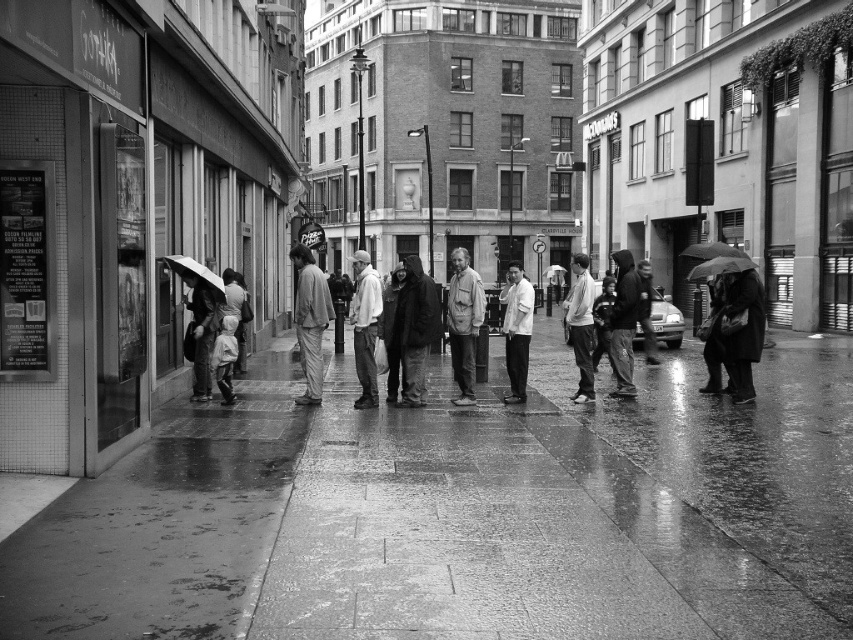
You are a photographer trying to capture the group of people on the sidewalk in this rainy urban scene. You notice the light gray fabric pants at center and the white matte shirt at center. Which clothing item appears narrower in the photo?

The light gray fabric pants at center appears narrower compared to the white matte shirt at center as stated in the objects description.

You are a photographer trying to capture the two people at the center of the scene. The light gray hoodie at center and the white matte shirt at center are standing side by side. Which of the two clothing items has a wider silhouette when viewed from your current position?

The light gray hoodie at center has a wider silhouette than the white matte shirt at center because its width surpasses the latter according to the description.

You are a photographer trying to capture the light gray fabric pants at center in this rainy urban scene. Based on the coordinates provided, where should you aim your camera to ensure the pants are centered in your shot?

You should aim your camera at the coordinates point (x=310, y=321) to center the light gray fabric pants at center in your shot.